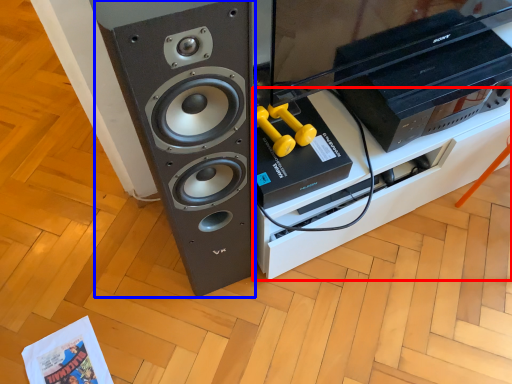
Question: Among these objects, which one is nearest to the camera, furniture (highlighted by a red box) or speaker (highlighted by a blue box)?

Choices:
 (A) furniture
 (B) speaker

Answer: (B)